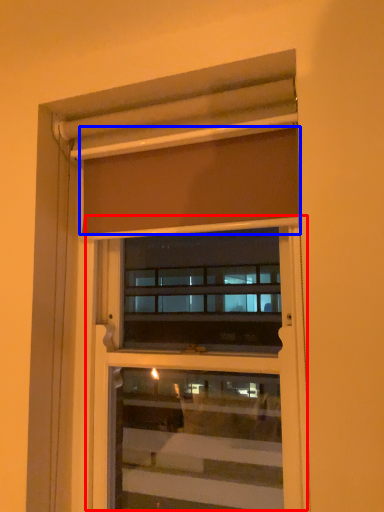
Question: Which object is further to the camera taking this photo, screen door (highlighted by a red box) or curtain (highlighted by a blue box)?

Choices:
 (A) screen door
 (B) curtain

Answer: (A)